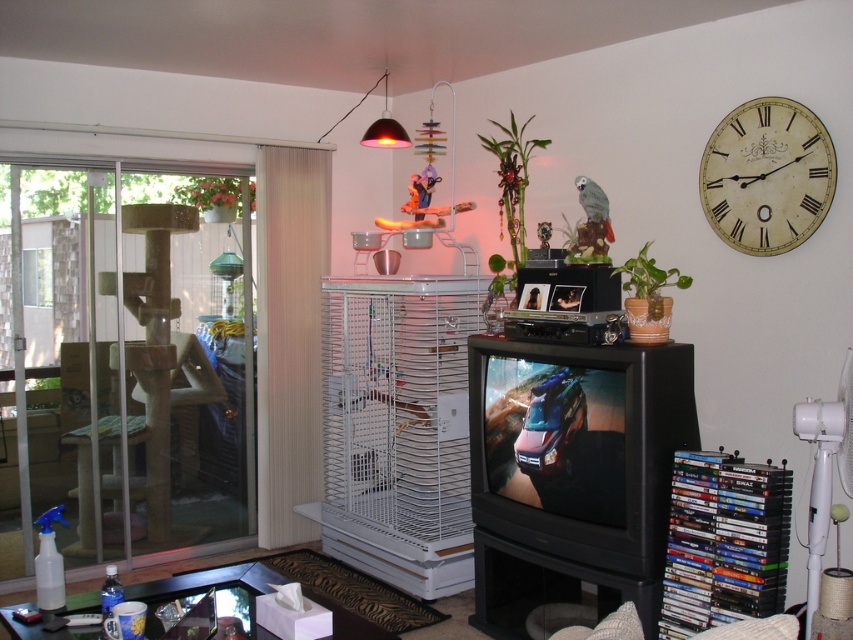
Is clear glass door at left in front of ivory/off-white/smooth clock at upper right?

No, it is not.

Who is higher up, clear glass door at left or ivory/off-white/smooth clock at upper right?

ivory/off-white/smooth clock at upper right is above.

Is point (234, 336) behind point (756, 177)?

Yes, it is behind point (756, 177).

Where is `clear glass door at left`? This screenshot has height=640, width=853. clear glass door at left is located at coordinates (123, 358).

What do you see at coordinates (572, 474) in the screenshot? I see `black plastic television at lower right` at bounding box center [572, 474].

Is point (546, 390) more distant than point (76, 173)?

No, it is not.

Identify the location of black plastic television at lower right. The width and height of the screenshot is (853, 640). (572, 474).

In the scene shown: Which is below, clear glass door at left or black plastic television at lower right?

black plastic television at lower right

The height and width of the screenshot is (640, 853). I want to click on clear glass door at left, so click(123, 358).